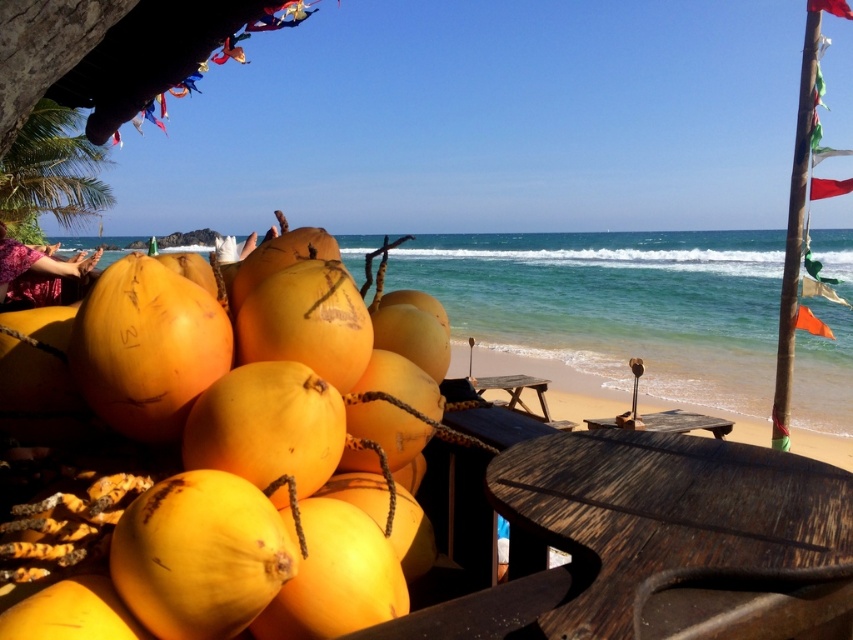
Question: Which object appears closest to the camera in this image?

Choices:
 (A) orange fabric flag at right
 (B) smooth sand beach at center
 (C) red fabric flag at upper right
 (D) yellow matte coconuts at center

Answer: (D)

Question: Which of these objects is positioned farthest from the smooth sand beach at center?

Choices:
 (A) green fabric flag at right
 (B) red fabric flag at upper right
 (C) yellow matte coconuts at center

Answer: (C)

Question: Does smooth sand beach at center have a greater width compared to orange fabric flag at right?

Choices:
 (A) yes
 (B) no

Answer: (B)

Question: Does yellow matte coconuts at center have a larger size compared to smooth sand beach at center?

Choices:
 (A) yes
 (B) no

Answer: (A)

Question: Which is nearer to the orange fabric flag at right?

Choices:
 (A) red fabric flag at upper right
 (B) green fabric flag at right
 (C) smooth sand beach at center
 (D) yellow matte coconuts at center

Answer: (B)

Question: Does smooth sand beach at center have a lesser width compared to green fabric flag at right?

Choices:
 (A) yes
 (B) no

Answer: (A)